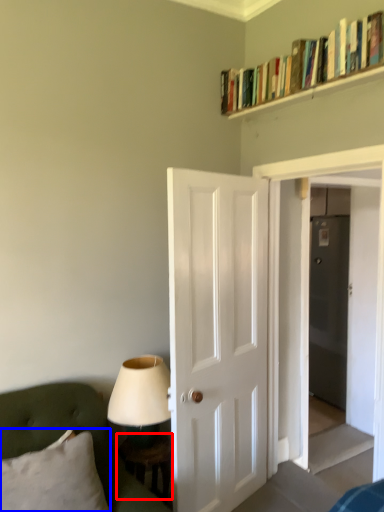
Question: Which object is further to the camera taking this photo, table (highlighted by a red box) or pillow (highlighted by a blue box)?

Choices:
 (A) table
 (B) pillow

Answer: (A)